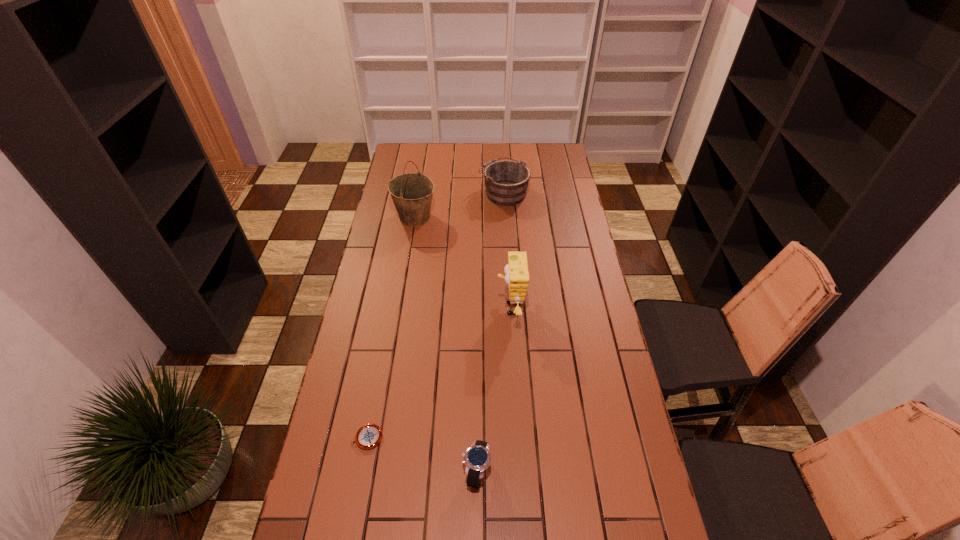
You are a GUI agent. You are given a task and a screenshot of the screen. Output one action in this format:
    pyautogui.click(x=<x>, y=<y>)
    Task: Click on the left wine bucket
    
    Given the screenshot: What is the action you would take?
    pyautogui.click(x=412, y=193)

The width and height of the screenshot is (960, 540). I want to click on the tallest object, so click(x=412, y=193).

Find the location of a particular element. This screenshot has width=960, height=540. the third farthest object is located at coordinates (517, 276).

You are a GUI agent. You are given a task and a screenshot of the screen. Output one action in this format:
    pyautogui.click(x=<x>, y=<y>)
    Task: Click on the fourth shortest object
    The width and height of the screenshot is (960, 540).
    Given the screenshot: What is the action you would take?
    tap(517, 276)

The width and height of the screenshot is (960, 540). Identify the location of the third shortest object. (506, 181).

Locate an element on the screen. the shorter wine bucket is located at coordinates (506, 181).

Where is `watch`? watch is located at coordinates (477, 458).

Locate an element on the screen. This screenshot has width=960, height=540. the shortest object is located at coordinates click(x=368, y=436).

Locate an element on the screen. The width and height of the screenshot is (960, 540). vacant space located 0.150m on the back of the taller wine bucket is located at coordinates (420, 186).

The image size is (960, 540). Find the location of `vacant space located 0.370m on the front-facing side of the second tallest object`. vacant space located 0.370m on the front-facing side of the second tallest object is located at coordinates (396, 308).